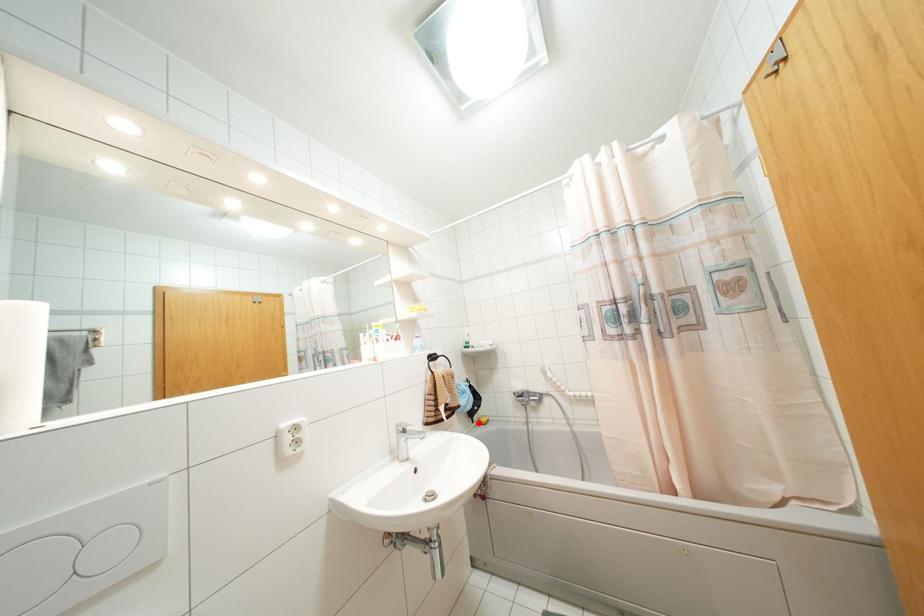
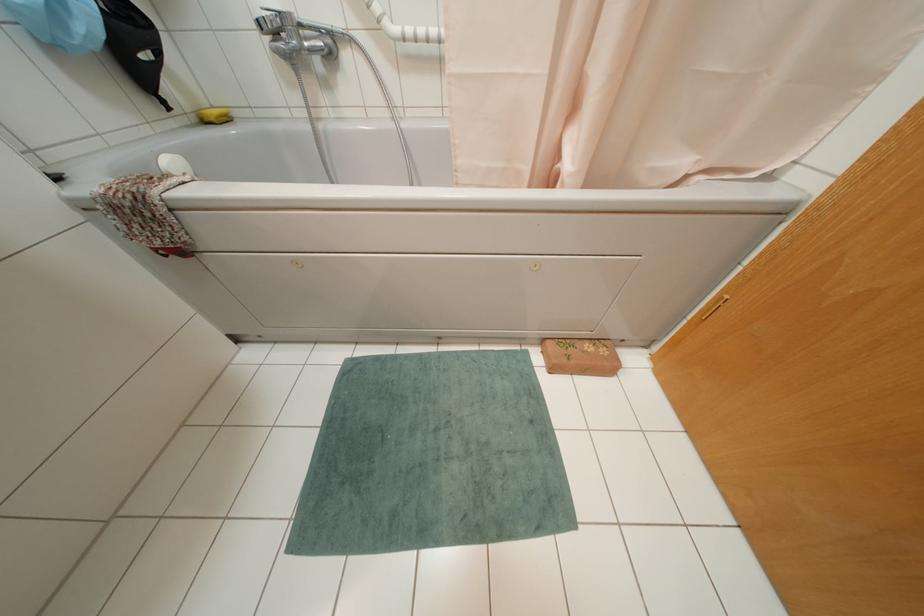
Question: A red point is marked in image1. In image2, is the corresponding 3D point closer to the camera or farther? Reply with the corresponding letter.

Choices:
 (A) The corresponding 3D point is closer.
 (B) The corresponding 3D point is farther.

Answer: (A)